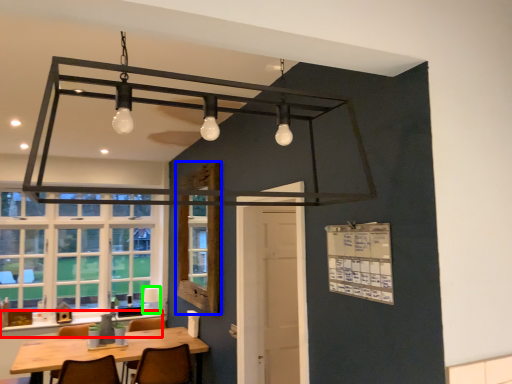
Question: Based on their relative distances, which object is farther from counter top (highlighted by a red box)? Choose from window screen (highlighted by a blue box) and lamp (highlighted by a green box).

Choices:
 (A) window screen
 (B) lamp

Answer: (A)